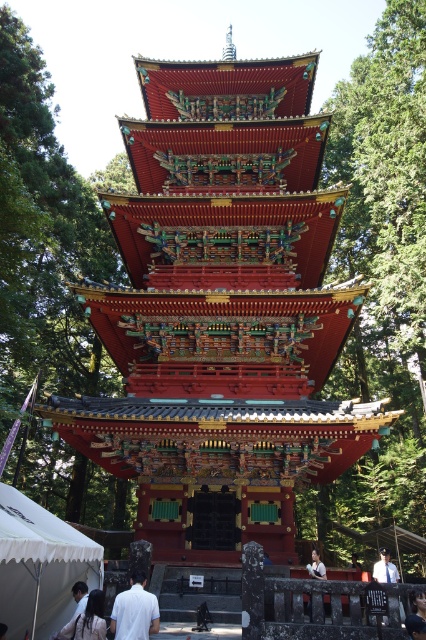
From the picture: Between dark hair at lower left and light brown wooden chair at lower center, which one has more height?

With more height is dark hair at lower left.

Can you confirm if dark hair at lower left is positioned below light brown wooden chair at lower center?

No, dark hair at lower left is not below light brown wooden chair at lower center.

Is point (86, 611) behind point (316, 561)?

That is False.

Where is `dark hair at lower left`? The height and width of the screenshot is (640, 426). dark hair at lower left is located at coordinates (86, 620).

Is green textured pagoda at center closer to camera compared to dark blue fabric cap at lower right?

No.

Can you confirm if green textured pagoda at center is smaller than dark blue fabric cap at lower right?

No.

What do you see at coordinates (43, 240) in the screenshot? I see `green textured pagoda at center` at bounding box center [43, 240].

What are the coordinates of `green textured pagoda at center` in the screenshot? It's located at [x=43, y=240].

Is point (131, 586) closer to viewer compared to point (89, 612)?

That is False.

Which is more to the right, white cotton shirt at lower left or dark hair at lower left?

From the viewer's perspective, white cotton shirt at lower left appears more on the right side.

Which is behind, point (121, 634) or point (69, 624)?

The point (69, 624) is more distant.

Find the location of `white cotton shirt at lower left`. white cotton shirt at lower left is located at coordinates (135, 611).